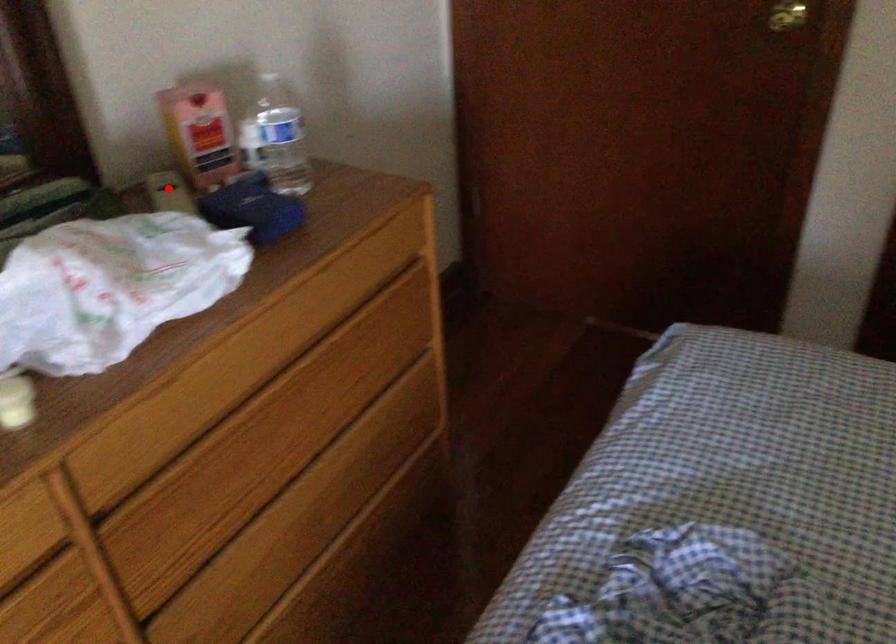
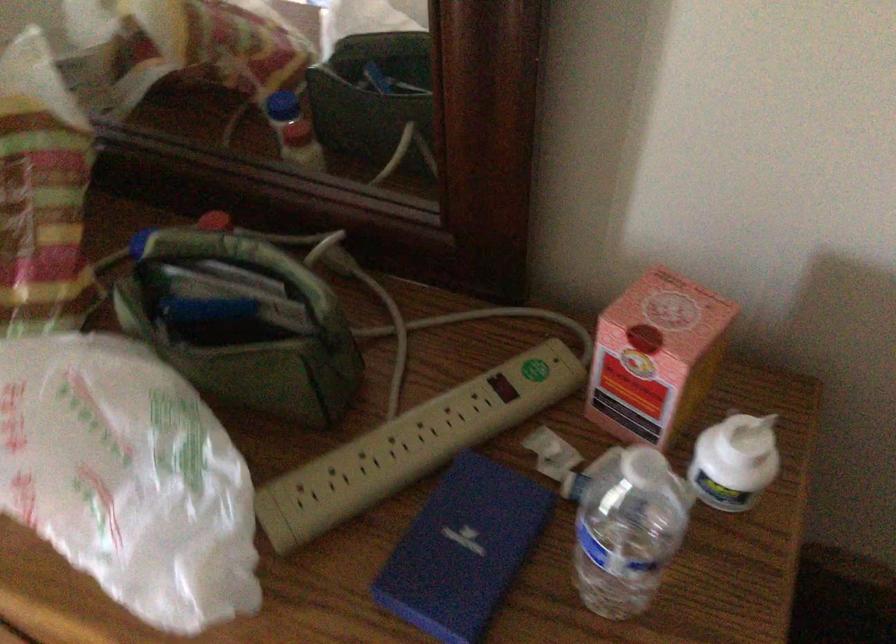
Where in the second image is the point corresponding to the highlighted location from the first image?

(503, 386)